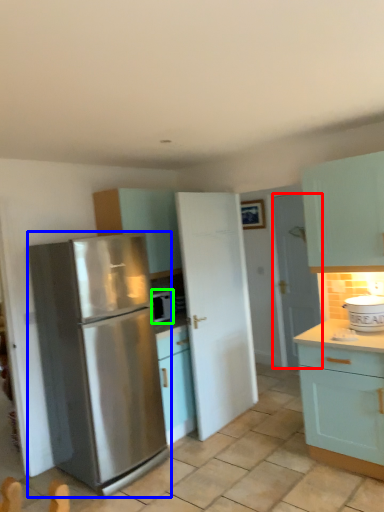
Question: Which is nearer to the door (highlighted by a red box)? refrigerator (highlighted by a blue box) or appliance (highlighted by a green box).

Choices:
 (A) refrigerator
 (B) appliance

Answer: (B)